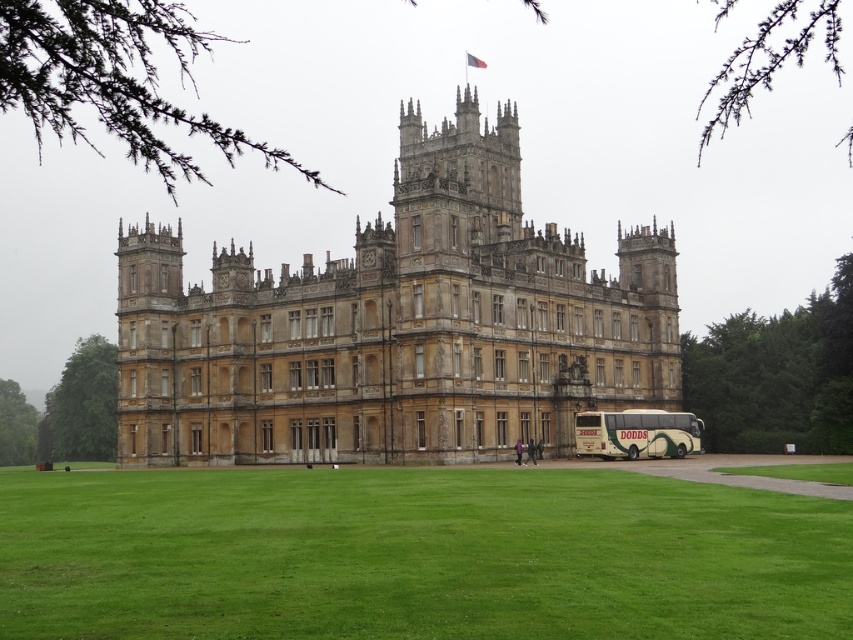
Question: Observing the image, what is the correct spatial positioning of green grass at lower center in reference to beige textured bus at lower right?

Choices:
 (A) left
 (B) right

Answer: (A)

Question: Is green grass at lower center to the left of beige textured bus at lower right from the viewer's perspective?

Choices:
 (A) yes
 (B) no

Answer: (A)

Question: Which object appears farthest from the camera in this image?

Choices:
 (A) beige textured bus at lower right
 (B) green grass at lower center
 (C) golden stone castle at center

Answer: (A)

Question: Which point is farther to the camera?

Choices:
 (A) (676, 627)
 (B) (648, 264)

Answer: (B)

Question: From the image, what is the correct spatial relationship of green grass at lower center in relation to golden stone castle at center?

Choices:
 (A) below
 (B) above

Answer: (A)

Question: Which point is closer to the camera taking this photo?

Choices:
 (A) (260, 577)
 (B) (642, 432)

Answer: (A)